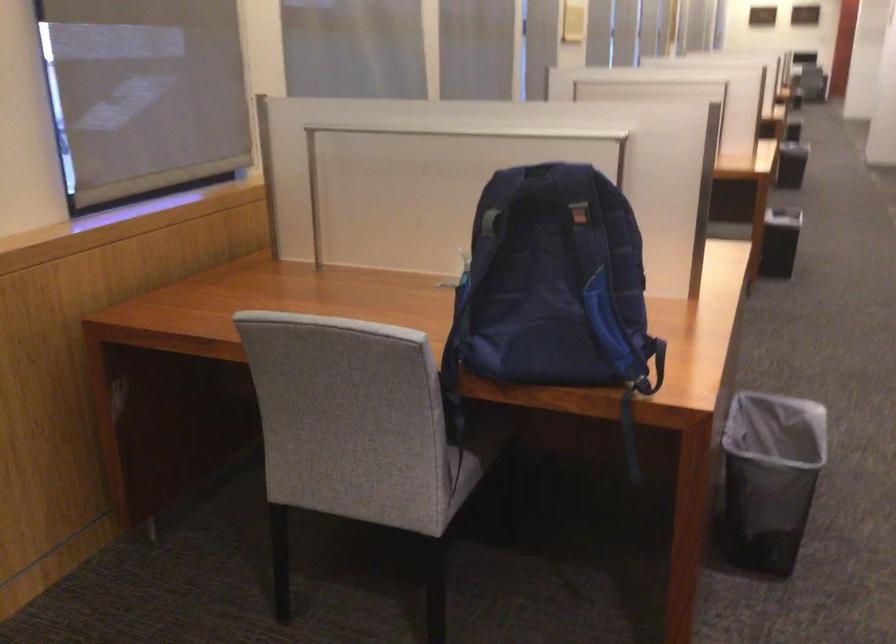
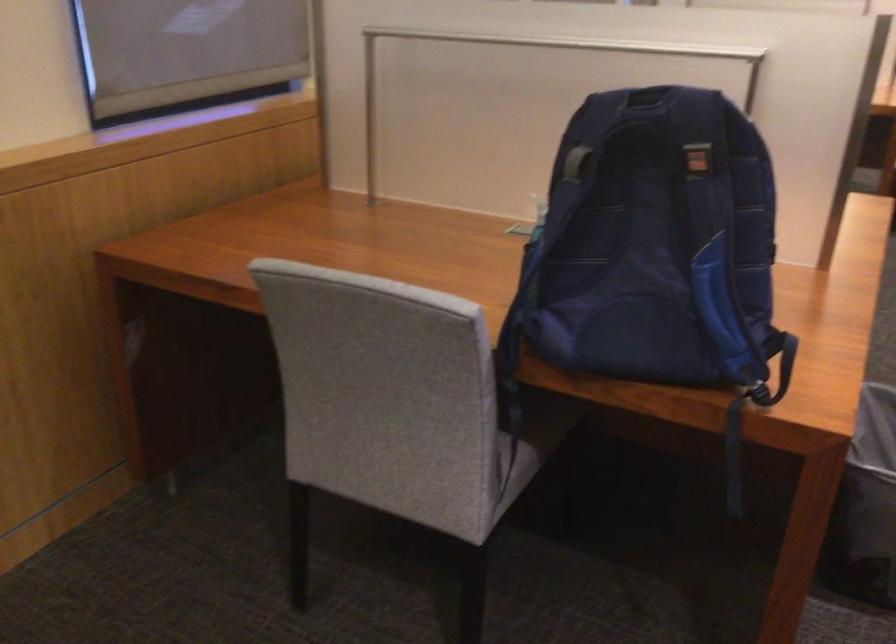
Question: Based on the continuous images, in which direction is the camera rotating? Reply with the corresponding letter.

Choices:
 (A) Left
 (B) Right
 (C) Up
 (D) Down

Answer: (D)